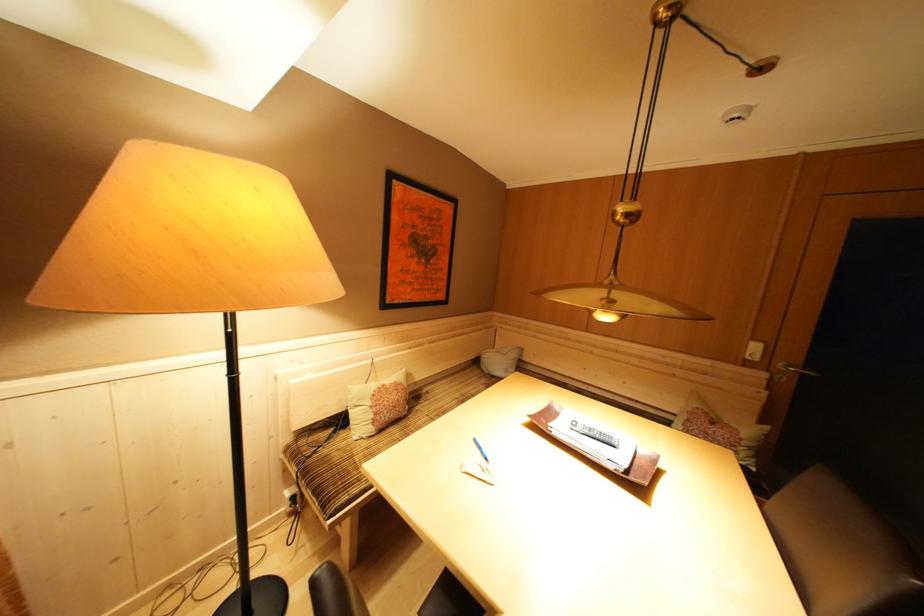
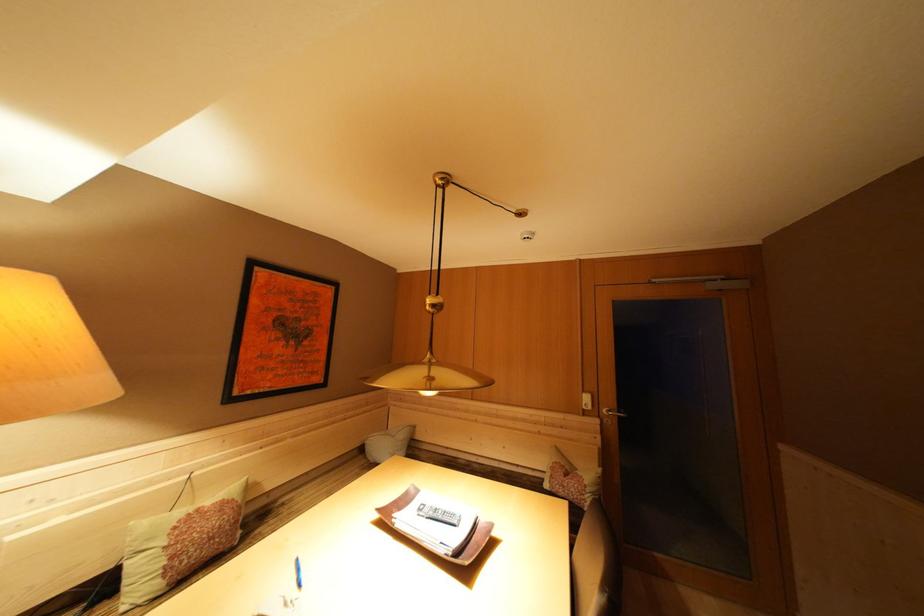
Find the pixel in the second image that matches (537,421) in the first image.

(384, 515)